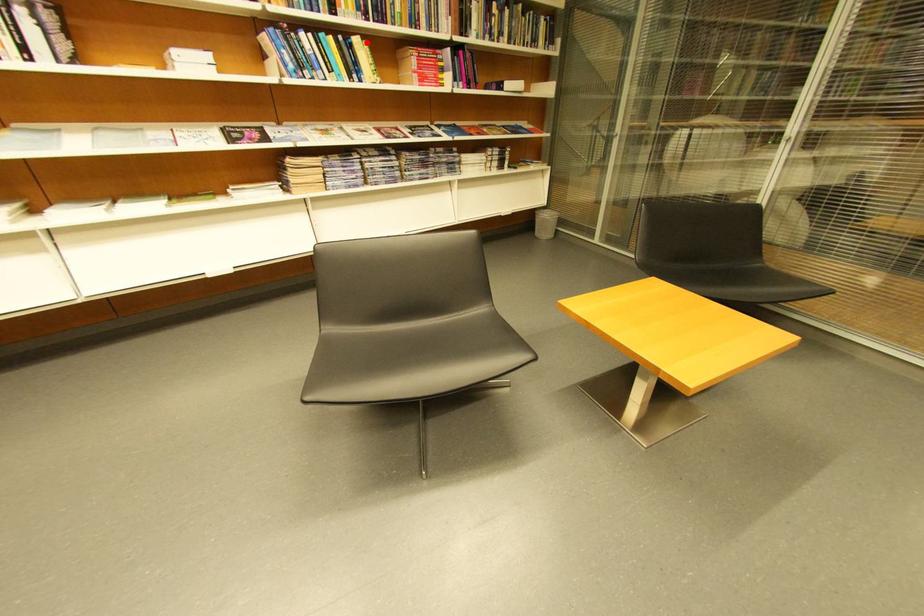
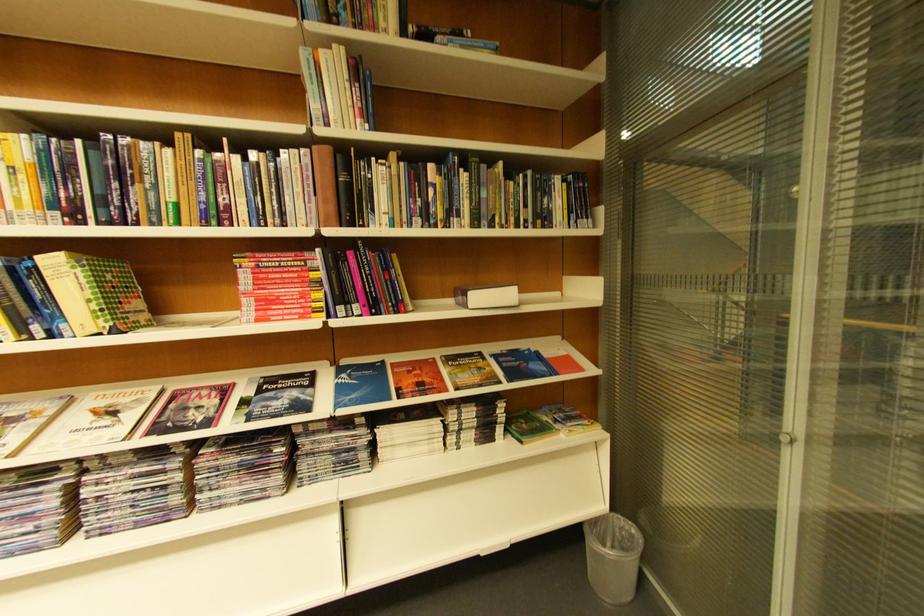
Locate, in the second image, the point that corresponds to the highlighted location in the first image.

(63, 264)